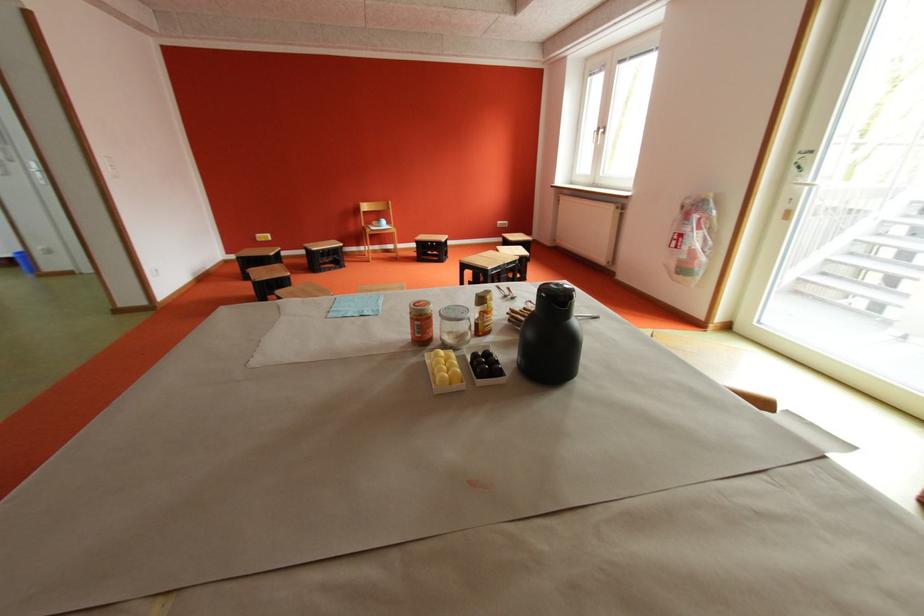
Where would you lift the small blue ball? Please return your answer as a coordinate pair (x, y).

(485, 367)